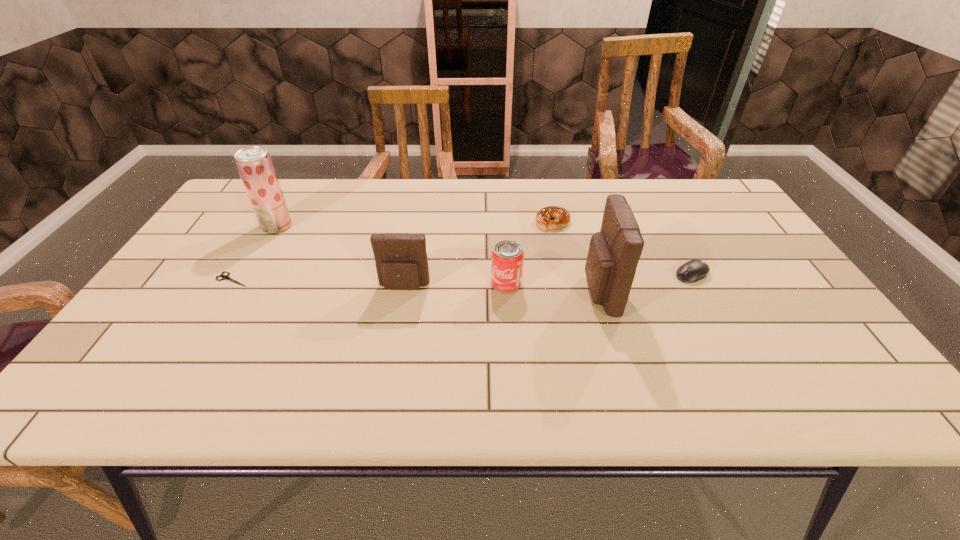
At what (x,y) coordinates should I click in order to perform the action: click on fruit juice present at the left edge. Please return your answer as a coordinate pair (x, y). Looking at the image, I should click on (254, 164).

You are a GUI agent. You are given a task and a screenshot of the screen. Output one action in this format:
    pyautogui.click(x=<x>, y=<y>)
    Task: Click on the shears at the left edge
    Image resolution: width=960 pixels, height=540 pixels.
    Given the screenshot: What is the action you would take?
    pyautogui.click(x=224, y=277)

Where is `object present at the far left corner`? object present at the far left corner is located at coordinates (254, 164).

Where is `vacant space at the far edge of the desktop`? vacant space at the far edge of the desktop is located at coordinates (444, 219).

In the image, there is a desktop. Where is `blank space at the near edge`? blank space at the near edge is located at coordinates (219, 348).

In the image, there is a desktop. At what (x,y) coordinates should I click in order to perform the action: click on vacant area at the near left corner. Please return your answer as a coordinate pair (x, y). Looking at the image, I should click on (121, 339).

Where is `free region at the near right corner`? The image size is (960, 540). free region at the near right corner is located at coordinates (804, 336).

Identify the location of empty location between the fruit juice and the taller pouch. This screenshot has height=540, width=960. (438, 259).

The image size is (960, 540). What are the coordinates of `free spot between the shortest object and the fruit juice` in the screenshot? It's located at (255, 253).

In order to click on free spot between the rightmost object and the taller pouch in this screenshot , I will do `click(645, 283)`.